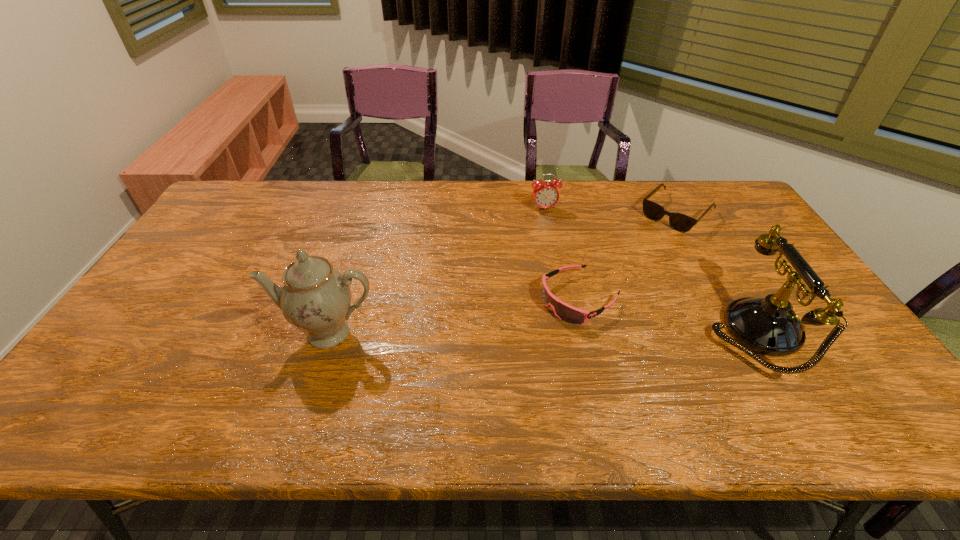
Where is `chinaware`? The height and width of the screenshot is (540, 960). chinaware is located at coordinates (316, 298).

At what (x,y) coordinates should I click in order to perform the action: click on telephone. Please return your answer as a coordinate pair (x, y). The image size is (960, 540). Looking at the image, I should click on coord(769,326).

Find the location of `sunglasses`. sunglasses is located at coordinates (680, 222).

The height and width of the screenshot is (540, 960). I want to click on goggles, so click(x=565, y=312).

The image size is (960, 540). Identify the location of the third shortest object. [545, 194].

Find the location of a particular element. free space located on the dial of the telephone is located at coordinates (819, 333).

Where is `vacant space located 0.160m at the front lenses of the sunglasses`? The image size is (960, 540). vacant space located 0.160m at the front lenses of the sunglasses is located at coordinates (636, 253).

You are a GUI agent. You are given a task and a screenshot of the screen. Output one action in this format:
    pyautogui.click(x=<x>, y=<y>)
    Task: Click on the blank space located at the front lenses of the sunglasses
    The image size is (960, 540).
    Given the screenshot: What is the action you would take?
    pyautogui.click(x=617, y=271)

Where is `free spot located 0.080m at the front lenses of the sunglasses`? free spot located 0.080m at the front lenses of the sunglasses is located at coordinates (648, 241).

At what (x,y) coordinates should I click in order to perform the action: click on free space located 0.170m on the front-facing side of the goggles. Please return your answer as a coordinate pair (x, y). Image resolution: width=960 pixels, height=540 pixels. Looking at the image, I should click on (498, 342).